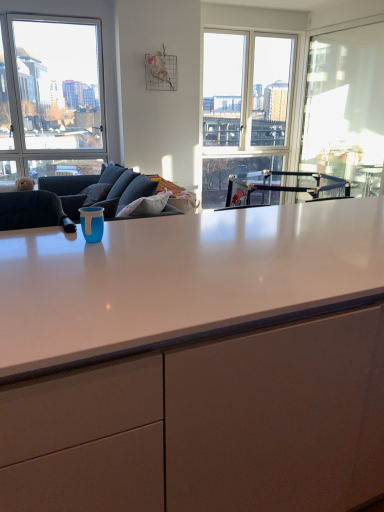
Question: From the image's perspective, relative to white glossy cabinet at center, is transparent glass window screen at right above or below?

Choices:
 (A) above
 (B) below

Answer: (A)

Question: Considering the positions of transparent glass window screen at right and white glossy cabinet at center in the image, is transparent glass window screen at right wider or thinner than white glossy cabinet at center?

Choices:
 (A) thin
 (B) wide

Answer: (A)

Question: Considering the real-world distances, which object is closest to the clear glass window at upper left?

Choices:
 (A) transparent glass window screen at right
 (B) white glossy cabinet at center

Answer: (A)

Question: Estimate the real-world distances between objects in this image. Which object is closer to the white glossy cabinet at center?

Choices:
 (A) clear glass window at upper left
 (B) transparent glass window screen at right

Answer: (B)